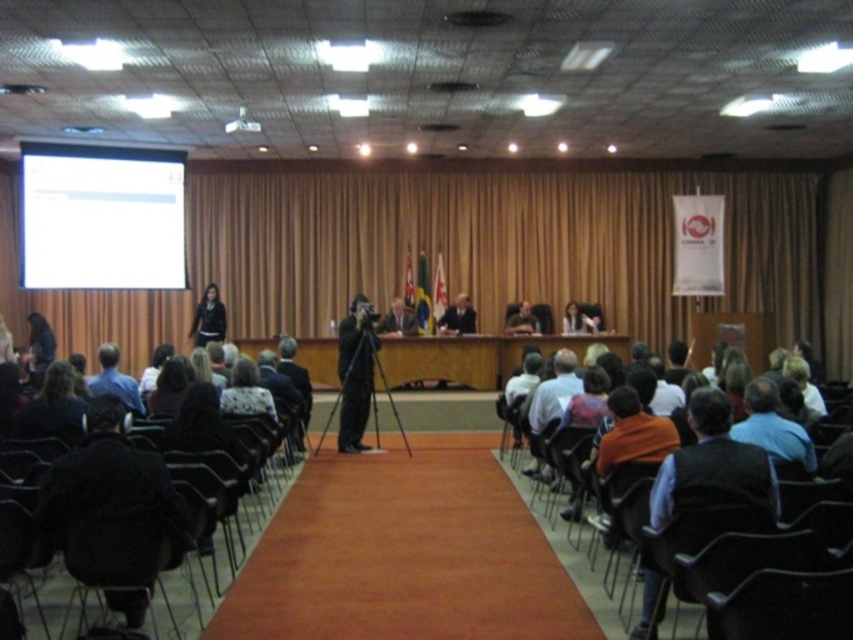
Can you confirm if brown fabric curtain at center is bigger than black fabric at left?

Indeed, brown fabric curtain at center has a larger size compared to black fabric at left.

Consider the image. Does brown fabric curtain at center appear under black fabric at left?

No, brown fabric curtain at center is not below black fabric at left.

Is point (738, 220) positioned in front of point (207, 284)?

No, (738, 220) is behind (207, 284).

The height and width of the screenshot is (640, 853). In order to click on brown fabric curtain at center in this screenshot , I will do coord(496,244).

Can you confirm if dark suit at center is positioned below matte black suit at center?

Yes, dark suit at center is below matte black suit at center.

Is dark suit at center in front of matte black suit at center?

Yes, it is.

Who is more distant from viewer, (444, 314) or (537, 326)?

Positioned behind is point (444, 314).

Image resolution: width=853 pixels, height=640 pixels. What are the coordinates of `dark suit at center` in the screenshot? It's located at (457, 317).

Which is more to the right, orange shirt at center or dark suit at center?

Positioned to the right is orange shirt at center.

Between orange shirt at center and dark suit at center, which one is positioned lower?

orange shirt at center is below.

Measure the distance between point (567,385) and camera.

Point (567,385) and camera are 6.17 meters apart.

Where is `orange shirt at center`? This screenshot has height=640, width=853. orange shirt at center is located at coordinates (550, 406).